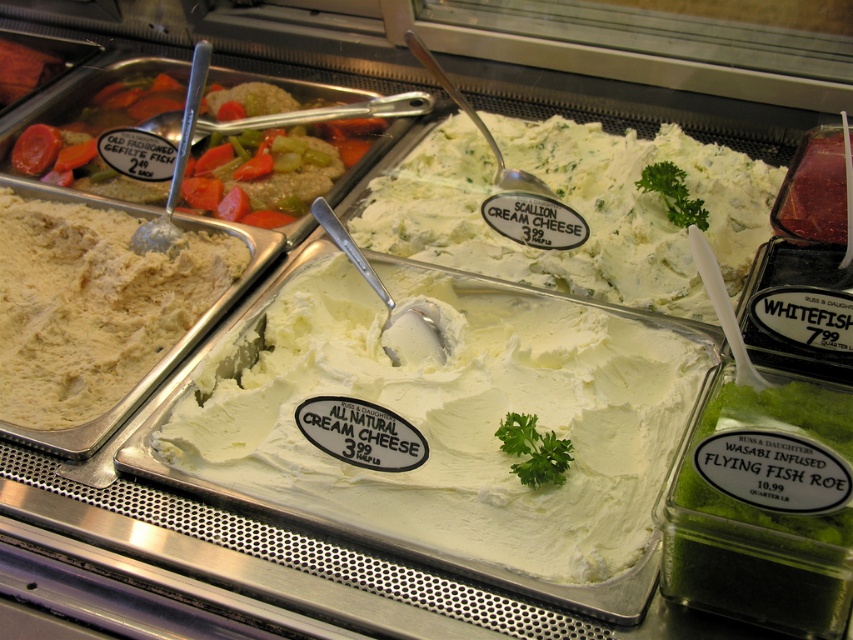
What is located at the point with coordinates (575, 209) in the refrigerated display case?

The point with coordinates (575, 209) is on the white creamy spread at center.

You are a customer at the deli and want to buy both the white creamy cream cheese at center and the white creamy spread at center. If your shopping basket is 12 inches wide, can both items fit side by side in the basket?

The white creamy cream cheese at center and white creamy spread at center are 11.46 inches apart, so they can fit side by side in a 12 inch wide basket since the total width required is less than the basket width.